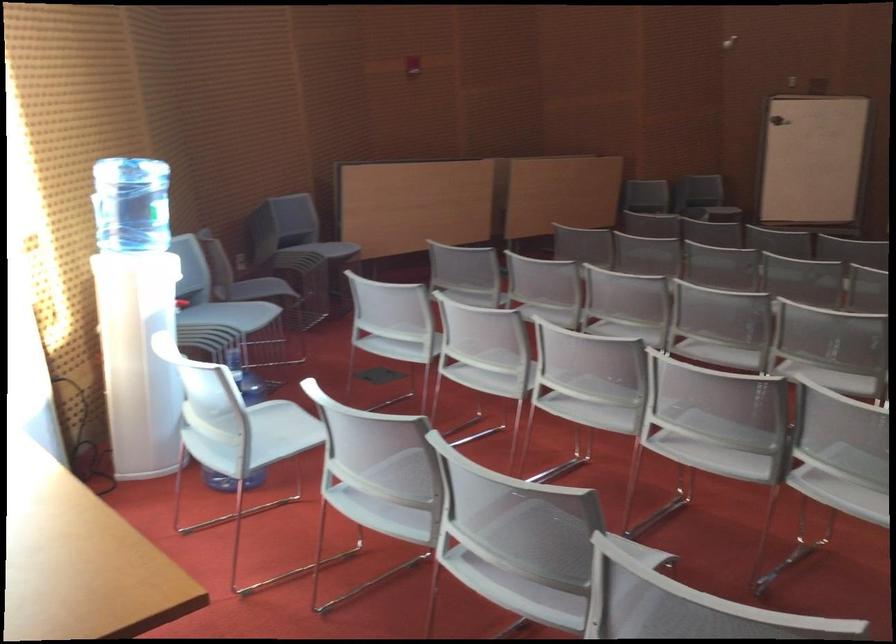
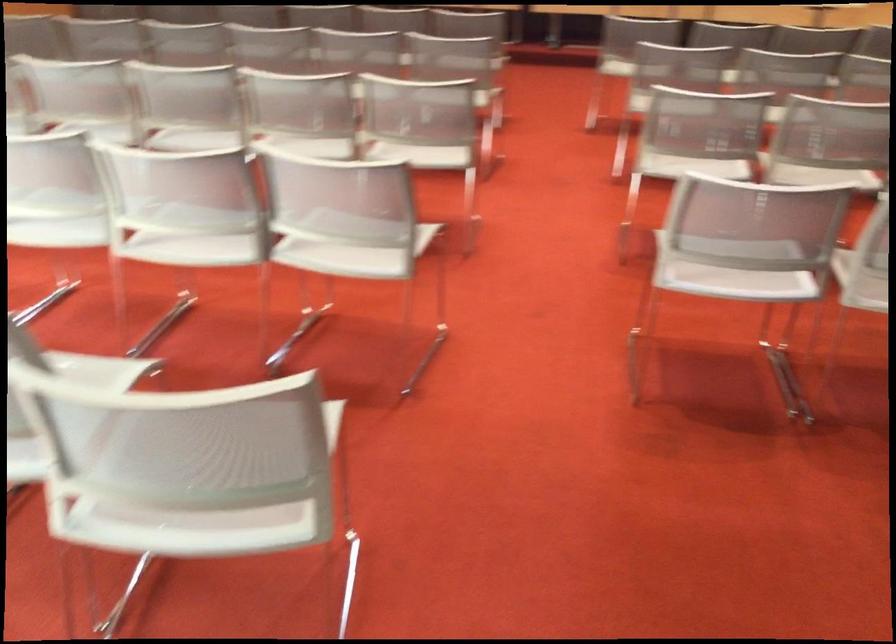
The first image is from the beginning of the video and the second image is from the end. How did the camera likely rotate when shooting the video?

The camera's rotation is toward right-down.